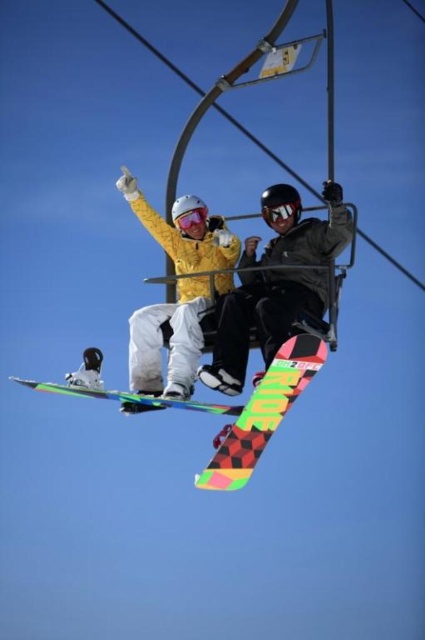
Question: In this image, where is matte black snowboard at center located relative to matte yellow snowboard at center?

Choices:
 (A) right
 (B) left

Answer: (A)

Question: Among these objects, which one is farthest from the camera?

Choices:
 (A) black matte goggles at upper center
 (B) matte yellow snowboard at center
 (C) multicolored checkered snowboard at center
 (D) matte pink goggles at center

Answer: (D)

Question: Observing the image, what is the correct spatial positioning of matte black snowboard at center in reference to neon checkered snowboard at center?

Choices:
 (A) below
 (B) above

Answer: (B)

Question: Which of the following is the farthest from the observer?

Choices:
 (A) multicolored checkered snowboard at center
 (B) matte pink goggles at center

Answer: (B)

Question: Does black matte goggles at upper center appear on the left side of matte pink goggles at center?

Choices:
 (A) yes
 (B) no

Answer: (B)

Question: Considering the real-world distances, which object is farthest from the matte yellow snowboard at center?

Choices:
 (A) matte black snowboard at center
 (B) black matte goggles at upper center
 (C) matte pink goggles at center
 (D) neon checkered snowboard at center

Answer: (D)